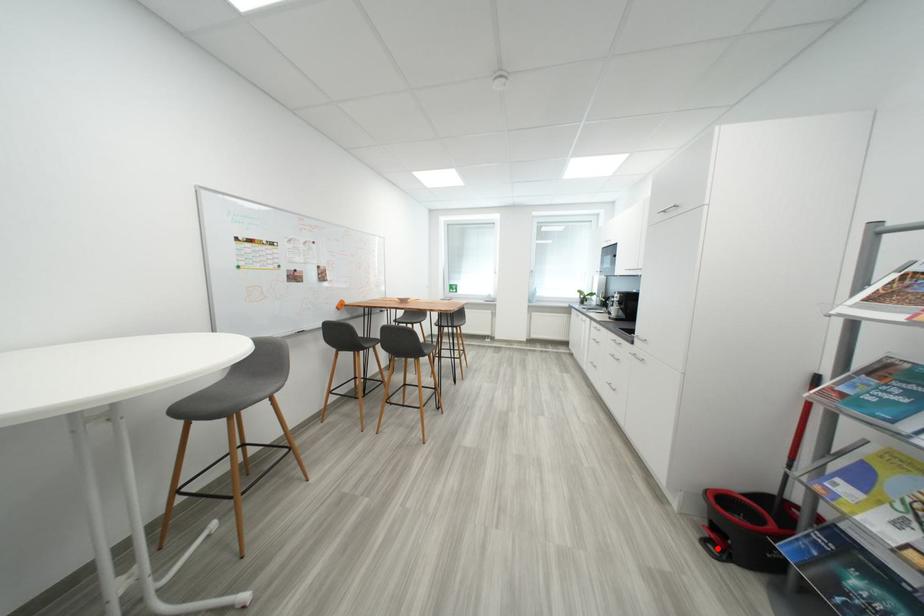
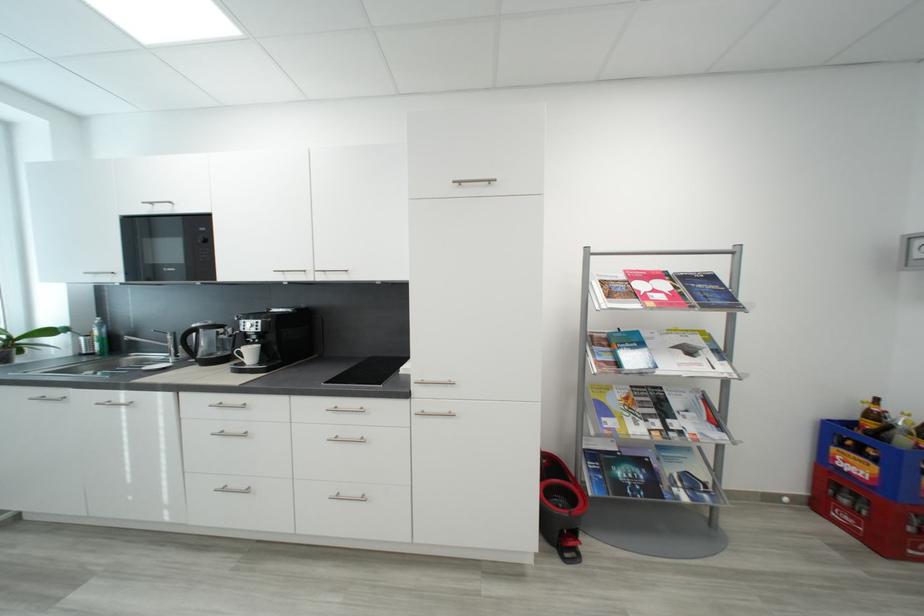
Question: I am providing you with two images of the same scene from different viewpoints. Given a red point in image1, look at the same physical point in image2. Is it:

Choices:
 (A) Closer to the viewpoint
 (B) Farther from the viewpoint

Answer: (B)